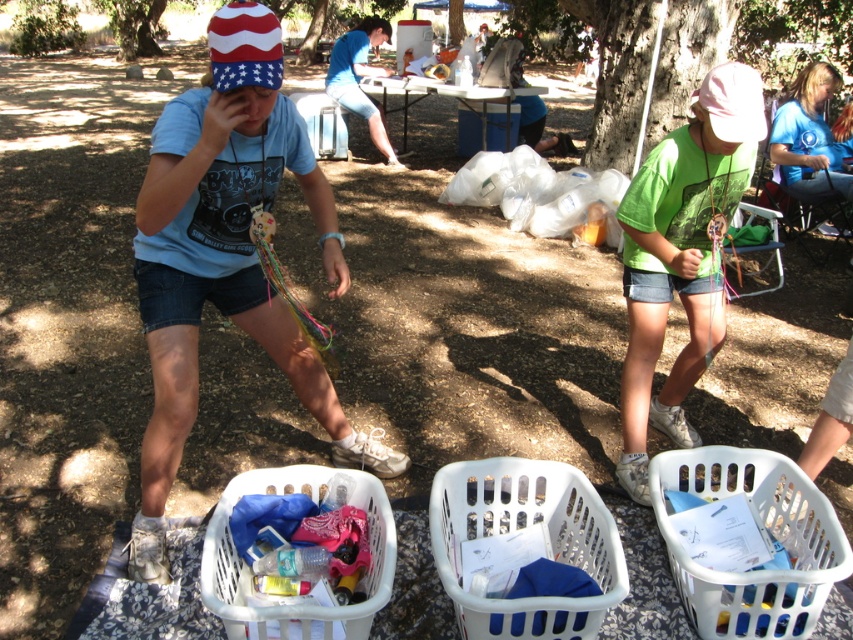
Looking at this image, who is higher up, green matte shirt at center or white plastic basket at center?

green matte shirt at center is above.

Looking at this image, who is lower down, green matte shirt at center or white plastic basket at center?

Positioned lower is white plastic basket at center.

What are the coordinates of `green matte shirt at center` in the screenshot? It's located at (682, 256).

Can you confirm if white plastic basket at lower center is bigger than blue t-shirt at lower right?

Incorrect, white plastic basket at lower center is not larger than blue t-shirt at lower right.

Where is `white plastic basket at lower center`? This screenshot has width=853, height=640. white plastic basket at lower center is located at coordinates (251, 572).

Is point (368, 481) positioned after point (795, 81)?

That is False.

Identify the location of white plastic basket at lower center. This screenshot has width=853, height=640. (251, 572).

Can you confirm if green matte shirt at center is shorter than metallic silver picnic table at center?

No, green matte shirt at center is not shorter than metallic silver picnic table at center.

Who is positioned more to the right, green matte shirt at center or metallic silver picnic table at center?

green matte shirt at center is more to the right.

Is point (672, 163) behind point (503, 129)?

No, (672, 163) is closer to viewer.

Where is `green matte shirt at center`? The height and width of the screenshot is (640, 853). green matte shirt at center is located at coordinates (682, 256).